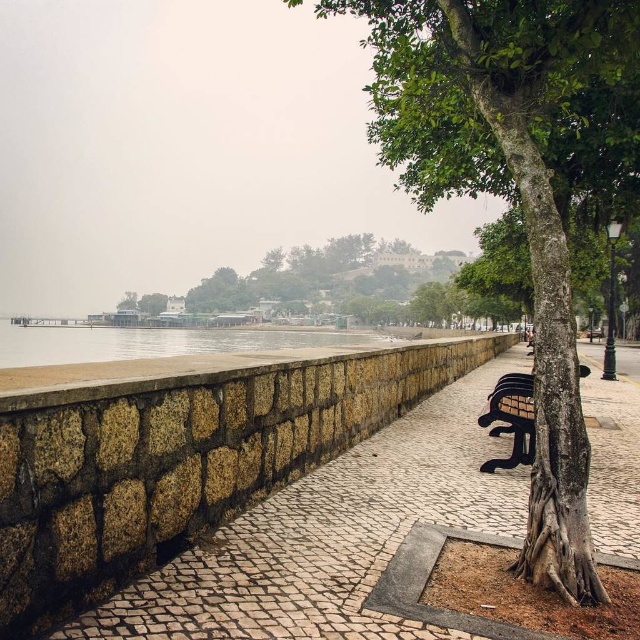
You are a visitor walking on the riverside promenade. You see the clear water at lower center and the metallic silver bench at right. Which object is closer to your current position?

The clear water at lower center is closer to your current position because it is above the metallic silver bench at right, indicating it is nearer in the visual hierarchy.

You are a photographer standing on the paved walkway and want to capture a photo of the metallic silver bench at right without the clear water at lower center appearing in the frame. Is this possible based on their positions?

The clear water at lower center is closer to the viewer than the metallic silver bench at right. To avoid including the clear water at lower center in the photo, you would need to position yourself so that the metallic silver bench at right is between you and the water, but since the water is closer, it would block the view of the bench. Therefore, it is not possible to capture the bench without the water appearing in the frame.